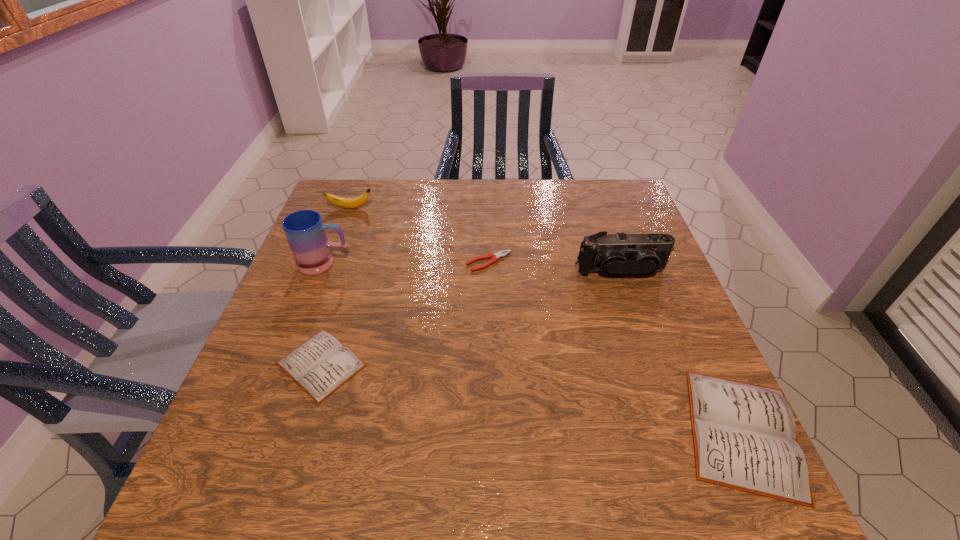
Select which object is the second closest to the pliers. Please provide its 2D coordinates. Your answer should be formatted as a tuple, i.e. [(x, y)], where the tuple contains the x and y coordinates of a point satisfying the conditions above.

[(320, 365)]

I want to click on free space in the image that satisfies the following two spatial constraints: 1. at the stem of the banana; 2. on the left side of the shorter diary, so click(x=292, y=364).

This screenshot has width=960, height=540. Identify the location of free spot that satisfies the following two spatial constraints: 1. on the side of the tallest object with the handle; 2. on the back side of the left diary. (285, 364).

Locate an element on the screen. free space in the image that satisfies the following two spatial constraints: 1. on the back side of the shorter diary; 2. at the stem of the fourth shortest object is located at coordinates (371, 208).

At what (x,y) coordinates should I click in order to perform the action: click on blank area in the image that satisfies the following two spatial constraints: 1. at the stem of the banana; 2. on the right side of the shortest object. Please return your answer as a coordinate pair (x, y). The image size is (960, 540). Looking at the image, I should click on (330, 262).

Locate an element on the screen. vacant space that satisfies the following two spatial constraints: 1. on the back side of the third object from right to left; 2. on the right side of the second shortest object is located at coordinates (354, 262).

Locate an element on the screen. This screenshot has width=960, height=540. vacant region that satisfies the following two spatial constraints: 1. on the back side of the second shortest object; 2. on the left side of the pliers is located at coordinates (354, 262).

Where is `blank space that satisfies the following two spatial constraints: 1. on the side of the third shortest object with the handle; 2. on the right side of the tallest object`? blank space that satisfies the following two spatial constraints: 1. on the side of the third shortest object with the handle; 2. on the right side of the tallest object is located at coordinates (259, 432).